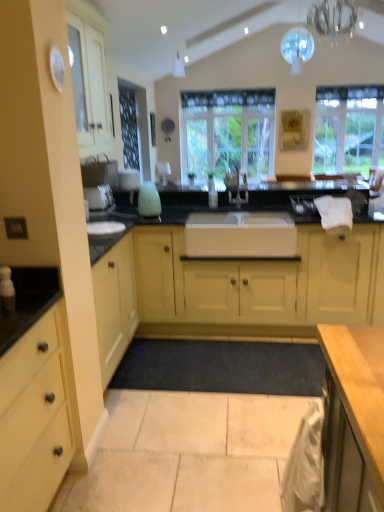
Question: Is clear glass chandelier at upper center, which ranks as the second light fixture in top-to-bottom order, bigger than matte yellow cabinet at left, the second cabinetry in the back-to-front sequence?

Choices:
 (A) no
 (B) yes

Answer: (A)

Question: Is clear glass chandelier at upper center, the 2th light fixture viewed from the back, positioned far away from matte yellow cabinet at left, the second cabinetry in the back-to-front sequence?

Choices:
 (A) yes
 (B) no

Answer: (A)

Question: Does clear glass chandelier at upper center, which ranks as the second light fixture in top-to-bottom order, appear on the left side of matte yellow cabinet at left, the 1th cabinetry when ordered from front to back?

Choices:
 (A) yes
 (B) no

Answer: (B)

Question: Is clear glass chandelier at upper center, which ranks as the second light fixture in top-to-bottom order, located outside matte yellow cabinet at left, the 1th cabinetry when ordered from front to back?

Choices:
 (A) yes
 (B) no

Answer: (A)

Question: Is clear glass chandelier at upper center, the 2th light fixture viewed from the back, with matte yellow cabinet at left, the second cabinetry in the back-to-front sequence?

Choices:
 (A) no
 (B) yes

Answer: (A)

Question: From a real-world perspective, does clear glass chandelier at upper center, which ranks as the second light fixture in top-to-bottom order, sit lower than matte yellow cabinet at left, the 1th cabinetry when ordered from front to back?

Choices:
 (A) yes
 (B) no

Answer: (B)

Question: Is matte yellow cabinets at center, acting as the second cabinetry starting from the front, not close to clear glass window at upper right, marked as the first window in a right-to-left arrangement?

Choices:
 (A) yes
 (B) no

Answer: (A)

Question: From the image's perspective, does matte yellow cabinets at center, which appears as the first cabinetry when viewed from the back, appear higher than clear glass window at upper right, marked as the first window in a right-to-left arrangement?

Choices:
 (A) no
 (B) yes

Answer: (A)

Question: Considering the relative sizes of matte yellow cabinets at center, acting as the second cabinetry starting from the front, and clear glass window at upper right, acting as the 2th window starting from the left, in the image provided, is matte yellow cabinets at center, acting as the second cabinetry starting from the front, smaller than clear glass window at upper right, acting as the 2th window starting from the left,?

Choices:
 (A) yes
 (B) no

Answer: (B)

Question: Can you confirm if matte yellow cabinets at center, which appears as the first cabinetry when viewed from the back, is wider than clear glass window at upper right, acting as the 2th window starting from the left?

Choices:
 (A) yes
 (B) no

Answer: (A)

Question: Is matte yellow cabinets at center, which appears as the first cabinetry when viewed from the back, turned away from clear glass window at upper right, marked as the first window in a right-to-left arrangement?

Choices:
 (A) yes
 (B) no

Answer: (A)

Question: Is the position of matte yellow cabinets at center, acting as the second cabinetry starting from the front, less distant than that of clear glass window at upper right, acting as the 2th window starting from the left?

Choices:
 (A) yes
 (B) no

Answer: (A)

Question: Is clear glass chandelier at upper center, marked as the 1th light fixture in a front-to-back arrangement, to the left of matte yellow cabinets at center, acting as the second cabinetry starting from the front, from the viewer's perspective?

Choices:
 (A) yes
 (B) no

Answer: (B)